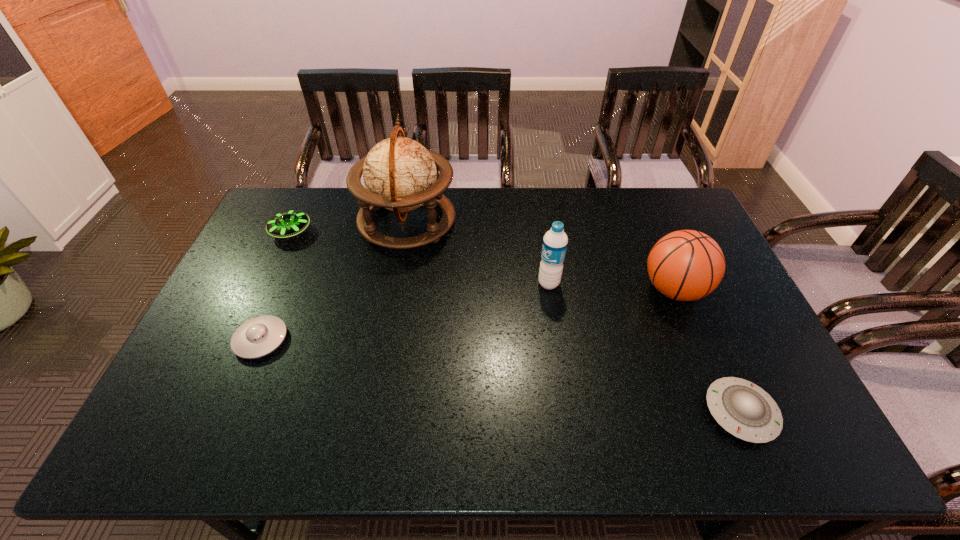
This screenshot has height=540, width=960. What are the coordinates of `the fourth object from right to left` in the screenshot? It's located at (399, 174).

You are a GUI agent. You are given a task and a screenshot of the screen. Output one action in this format:
    pyautogui.click(x=<x>, y=<y>)
    Task: Click on the globe
    
    Given the screenshot: What is the action you would take?
    pyautogui.click(x=399, y=174)

At what (x,y) coordinates should I click in order to perform the action: click on the third object from right to left. Please return your answer as a coordinate pair (x, y). Looking at the image, I should click on pyautogui.click(x=555, y=241).

Locate an element on the screen. The height and width of the screenshot is (540, 960). basketball is located at coordinates (685, 265).

This screenshot has width=960, height=540. Find the location of `the third shortest object`. the third shortest object is located at coordinates (286, 224).

Where is `the farthest saucer`? This screenshot has width=960, height=540. the farthest saucer is located at coordinates (286, 224).

Where is `the fifth farthest object`? The image size is (960, 540). the fifth farthest object is located at coordinates (257, 337).

Where is `the nearest object`? This screenshot has width=960, height=540. the nearest object is located at coordinates (745, 410).

This screenshot has width=960, height=540. Find the location of `the nearest saucer`. the nearest saucer is located at coordinates (745, 410).

Identify the location of free space located 0.120m on the left of the third object from left to right. (324, 221).